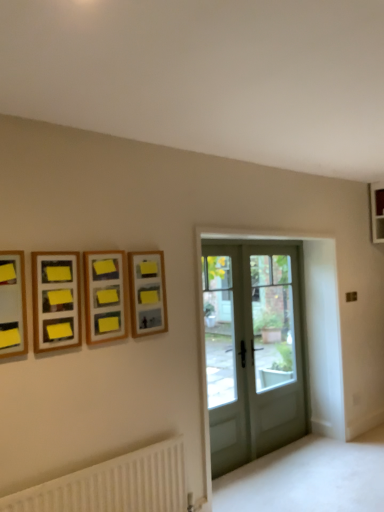
How much space does wooden frame at upper center, which ranks as the fourth picture frame in front-to-back order, occupy horizontally?

2.85 inches.

Image resolution: width=384 pixels, height=512 pixels. Describe the element at coordinates (253, 351) in the screenshot. I see `matte glass door at center` at that location.

What do you see at coordinates (105, 296) in the screenshot? The height and width of the screenshot is (512, 384). I see `wooden frame with yellow sticky notes at upper left, which is the 2th picture frame in back-to-front order` at bounding box center [105, 296].

Measure the distance between point (126, 292) and camera.

The distance of point (126, 292) from camera is 2.58 meters.

This screenshot has height=512, width=384. What are the coordinates of `wooden picture frame at left, arranged as the fourth picture frame when viewed from the back` in the screenshot? It's located at (12, 304).

Locate an element on the screen. The image size is (384, 512). wooden frame at upper center, which ranks as the fourth picture frame in front-to-back order is located at coordinates tap(147, 293).

Is the surface of white textured radiator at lower left in direct contact with wooden frame with yellow sticky notes at upper left, marked as the second picture frame in a right-to-left arrangement?

No, white textured radiator at lower left is not touching wooden frame with yellow sticky notes at upper left, marked as the second picture frame in a right-to-left arrangement.

Does white textured radiator at lower left have a lesser height compared to wooden frame with yellow sticky notes at upper left, which is counted as the 3th picture frame, starting from the front?

No.

In the image, is white textured radiator at lower left positioned in front of or behind wooden frame with yellow sticky notes at upper left, which is counted as the 3th picture frame, starting from the front?

white textured radiator at lower left is positioned closer to the viewer than wooden frame with yellow sticky notes at upper left, which is counted as the 3th picture frame, starting from the front.

From a real-world perspective, is white textured radiator at lower left physically below wooden frame with yellow sticky notes at upper left, which is counted as the 3th picture frame, starting from the front?

Yes, from a real-world perspective, white textured radiator at lower left is below wooden frame with yellow sticky notes at upper left, which is counted as the 3th picture frame, starting from the front.

Consider the image. Is matte glass door at center aimed at clear glass door at center, the 2th screen door when ordered from back to front?

Yes, matte glass door at center is aimed at clear glass door at center, the 2th screen door when ordered from back to front.

Who is shorter, matte glass door at center or clear glass door at center, the second screen door when ordered from right to left?

Standing shorter between the two is clear glass door at center, the second screen door when ordered from right to left.

Considering the relative sizes of matte glass door at center and clear glass door at center, the 1th screen door when ordered from left to right, in the image provided, is matte glass door at center wider than clear glass door at center, the 1th screen door when ordered from left to right,?

No, matte glass door at center is not wider than clear glass door at center, the 1th screen door when ordered from left to right.

Where is `radiator beneath the wooden frame with yellow sticky notes at upper left, marked as the second picture frame in a right-to-left arrangement (from a real-world perspective)`? The width and height of the screenshot is (384, 512). radiator beneath the wooden frame with yellow sticky notes at upper left, marked as the second picture frame in a right-to-left arrangement (from a real-world perspective) is located at coordinates (114, 484).

Who is more distant, wooden frame with yellow sticky notes at upper left, which is the third picture frame from left to right, or white textured radiator at lower left?

wooden frame with yellow sticky notes at upper left, which is the third picture frame from left to right, is behind.

Does point (103, 341) appear closer or farther from the camera than point (159, 511)?

Point (103, 341) appears to be closer to the viewer than point (159, 511).

Is wooden frame with yellow sticky notes at upper left, marked as the second picture frame in a right-to-left arrangement, wider or thinner than white textured radiator at lower left?

Clearly, wooden frame with yellow sticky notes at upper left, marked as the second picture frame in a right-to-left arrangement, has more width compared to white textured radiator at lower left.

Can you confirm if white textured radiator at lower left is smaller than wooden frame at upper left, the 2th picture frame positioned from the left?

No.

Based on the photo, considering the relative sizes of white textured radiator at lower left and wooden frame at upper left, which is the third picture frame in right-to-left order, in the image provided, is white textured radiator at lower left taller than wooden frame at upper left, which is the third picture frame in right-to-left order,?

Yes, white textured radiator at lower left is taller than wooden frame at upper left, which is the third picture frame in right-to-left order.

From the image's perspective, is white textured radiator at lower left located above wooden frame at upper left, which is the third picture frame in right-to-left order?

No, from the image's perspective, white textured radiator at lower left is not on top of wooden frame at upper left, which is the third picture frame in right-to-left order.

Is white textured radiator at lower left further to the viewer compared to wooden frame at upper left, acting as the second picture frame starting from the front?

No, white textured radiator at lower left is in front of wooden frame at upper left, acting as the second picture frame starting from the front.

Is clear glass door at center, the 2th screen door when ordered from back to front, in front of white textured radiator at lower left?

No, it is not.

From the image's perspective, relative to white textured radiator at lower left, is clear glass door at center, the second screen door when ordered from right to left, above or below?

Clearly, from the image's perspective, clear glass door at center, the second screen door when ordered from right to left, is above white textured radiator at lower left.

Identify the location of radiator below the clear glass door at center, the 1th screen door when ordered from left to right (from the image's perspective). This screenshot has height=512, width=384. (114, 484).

How many degrees apart are the facing directions of white glass screen door at center, acting as the 1th screen door starting from the back, and white textured radiator at lower left?

0.261 degrees.

Is white glass screen door at center, acting as the 1th screen door starting from the back, further to camera compared to white textured radiator at lower left?

Yes, the depth of white glass screen door at center, acting as the 1th screen door starting from the back, is greater than that of white textured radiator at lower left.

Find the location of `the 2nd screen door behind the white textured radiator at lower left`. the 2nd screen door behind the white textured radiator at lower left is located at coordinates (273, 347).

Does white glass screen door at center, which appears as the second screen door when viewed from the front, appear on the right side of white textured radiator at lower left?

Yes, white glass screen door at center, which appears as the second screen door when viewed from the front, is to the right of white textured radiator at lower left.

Image resolution: width=384 pixels, height=512 pixels. I want to click on picture frame that is the 3rd one when counting upward from the white textured radiator at lower left (from the image's perspective), so click(x=12, y=304).

Who is taller, wooden picture frame at left, the 1th picture frame when ordered from left to right, or white textured radiator at lower left?

white textured radiator at lower left is taller.

Image resolution: width=384 pixels, height=512 pixels. In order to click on radiator in front of the wooden frame with yellow sticky notes at upper left, marked as the second picture frame in a right-to-left arrangement in this screenshot , I will do `click(114, 484)`.

From a real-world perspective, count 1st screen doors downward from the matte glass door at center and point to it. Please provide its 2D coordinates.

[(225, 358)]

Looking at the image, which one is located closer to clear glass door at center, the second screen door when ordered from right to left, wooden frame at upper left, acting as the second picture frame starting from the front, or white glass screen door at center, arranged as the 2th screen door when viewed from the left?

white glass screen door at center, arranged as the 2th screen door when viewed from the left, is positioned closer to the anchor clear glass door at center, the second screen door when ordered from right to left.

Which object lies nearer to the anchor point clear glass door at center, the second screen door when ordered from right to left, wooden frame with yellow sticky notes at upper left, which is counted as the 3th picture frame, starting from the front, or white textured radiator at lower left?

Among the two, white textured radiator at lower left is located nearer to clear glass door at center, the second screen door when ordered from right to left.

Which object lies further to the anchor point wooden picture frame at left, acting as the first picture frame starting from the front, white glass screen door at center, arranged as the 2th screen door when viewed from the left, or white textured radiator at lower left?

Based on the image, white glass screen door at center, arranged as the 2th screen door when viewed from the left, appears to be further to wooden picture frame at left, acting as the first picture frame starting from the front.

Which object lies further to the anchor point white textured radiator at lower left, clear glass door at center, the 1th screen door positioned from the front, or white glass screen door at center, acting as the 1th screen door starting from the back?

Among the two, white glass screen door at center, acting as the 1th screen door starting from the back, is located further to white textured radiator at lower left.

Estimate the real-world distances between objects in this image. Which object is closer to matte glass door at center, wooden frame with yellow sticky notes at upper left, which is the third picture frame from left to right, or wooden picture frame at left, arranged as the fourth picture frame when viewed from the back?

Based on the image, wooden frame with yellow sticky notes at upper left, which is the third picture frame from left to right, appears to be nearer to matte glass door at center.

Based on their spatial positions, is white glass screen door at center, arranged as the 2th screen door when viewed from the left, or wooden frame at upper left, which is the third picture frame in right-to-left order, closer to wooden frame with yellow sticky notes at upper left, which is the third picture frame from left to right?

wooden frame at upper left, which is the third picture frame in right-to-left order, is positioned closer to the anchor wooden frame with yellow sticky notes at upper left, which is the third picture frame from left to right.

From the image, which object appears to be nearer to wooden frame at upper center, the 1th picture frame when ordered from right to left, white textured radiator at lower left or clear glass door at center, the 1th screen door when ordered from left to right?

The object closer to wooden frame at upper center, the 1th picture frame when ordered from right to left, is white textured radiator at lower left.

Based on their spatial positions, is wooden frame at upper left, which is the third picture frame in right-to-left order, or white glass screen door at center, the first screen door in the right-to-left sequence, closer to wooden picture frame at left, the 1th picture frame when ordered from left to right?

Based on the image, wooden frame at upper left, which is the third picture frame in right-to-left order, appears to be nearer to wooden picture frame at left, the 1th picture frame when ordered from left to right.

This screenshot has height=512, width=384. Identify the location of picture frame between wooden frame with yellow sticky notes at upper left, marked as the second picture frame in a right-to-left arrangement, and white textured radiator at lower left from top to bottom. (56, 300).

Locate an element on the screen. The height and width of the screenshot is (512, 384). door located between white textured radiator at lower left and white glass screen door at center, arranged as the 2th screen door when viewed from the left, in the depth direction is located at coordinates (253, 351).

Locate an element on the screen. screen door located between white textured radiator at lower left and matte glass door at center in the depth direction is located at coordinates (225, 358).

I want to click on screen door located between wooden frame at upper left, acting as the second picture frame starting from the front, and white glass screen door at center, which appears as the second screen door when viewed from the front, in the depth direction, so click(x=225, y=358).